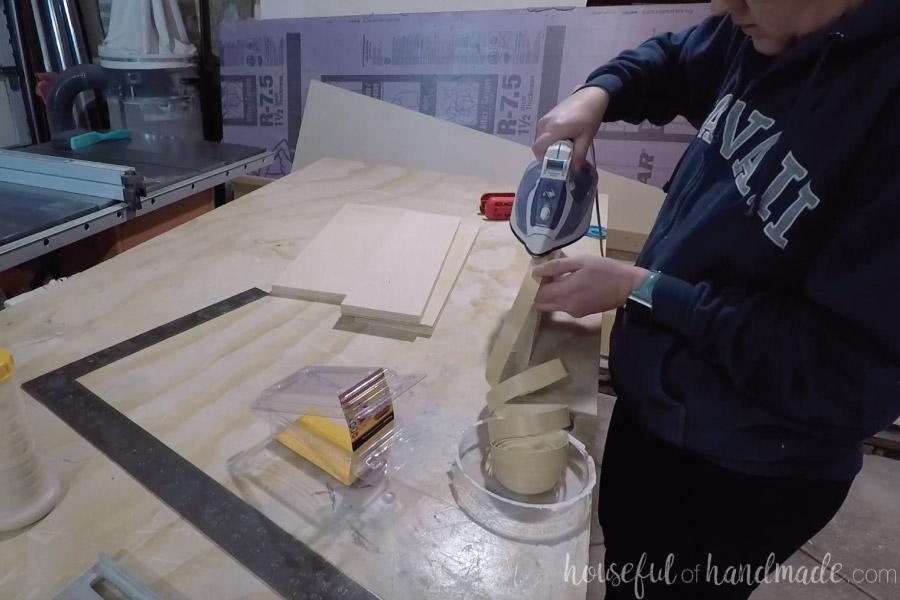
This screenshot has height=600, width=900. Identify the location of floor. (832, 531).